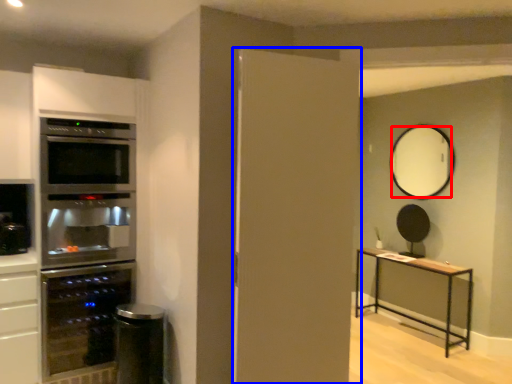
Question: Which point is further to the camera, mirror (highlighted by a red box) or door (highlighted by a blue box)?

Choices:
 (A) mirror
 (B) door

Answer: (A)